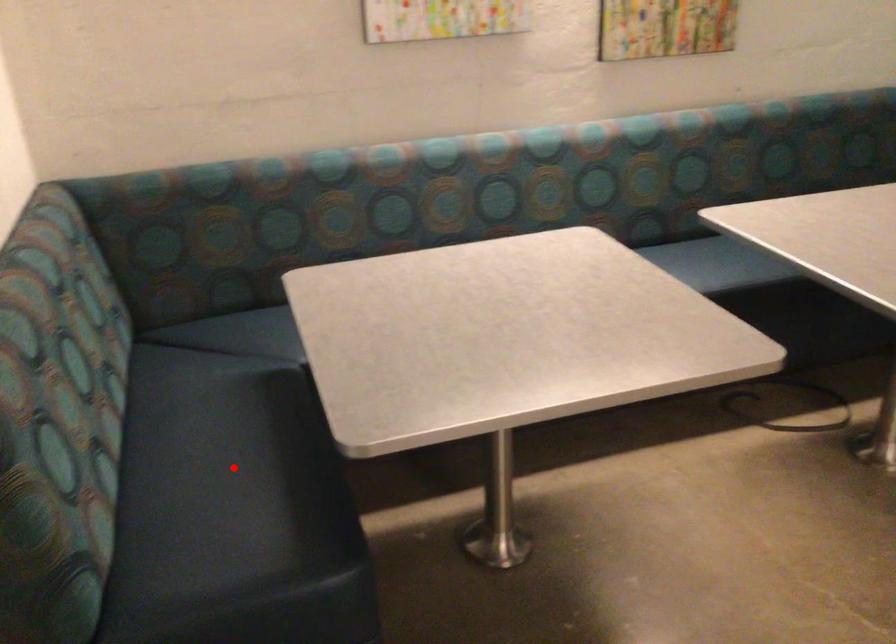
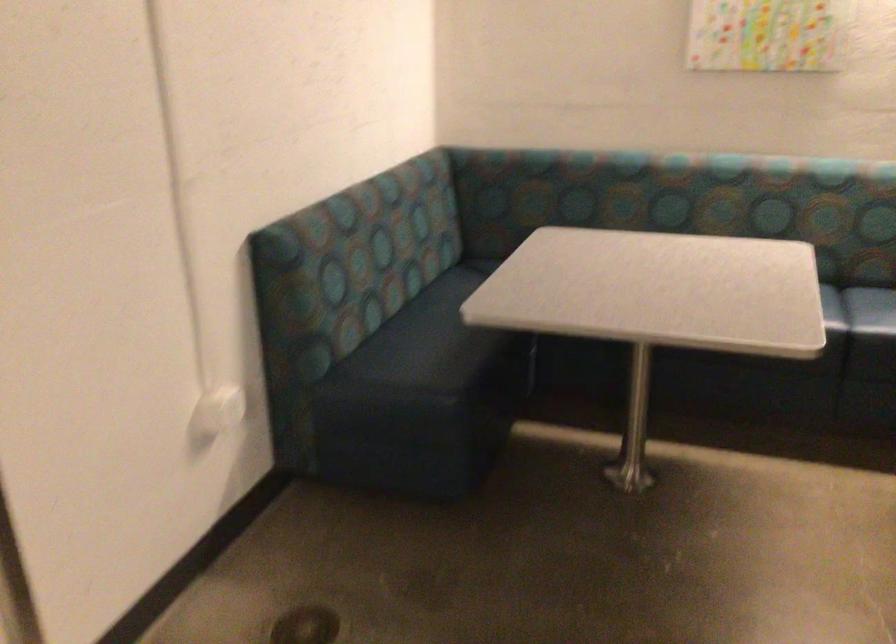
Question: I am providing you with two images of the same scene from different viewpoints. A red point is shown in image1. For the corresponding object point in image2, is it positioned nearer or farther from the camera?

Choices:
 (A) Nearer
 (B) Farther

Answer: (B)